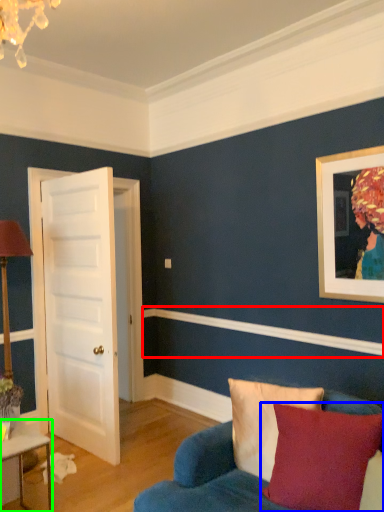
Question: Which is nearer to the molding (highlighted by a red box)? pillow (highlighted by a blue box) or table (highlighted by a green box).

Choices:
 (A) pillow
 (B) table

Answer: (A)